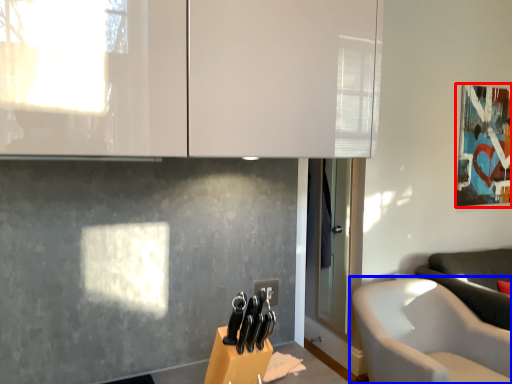
Question: Which object is further to the camera taking this photo, picture frame (highlighted by a red box) or chair (highlighted by a blue box)?

Choices:
 (A) picture frame
 (B) chair

Answer: (A)